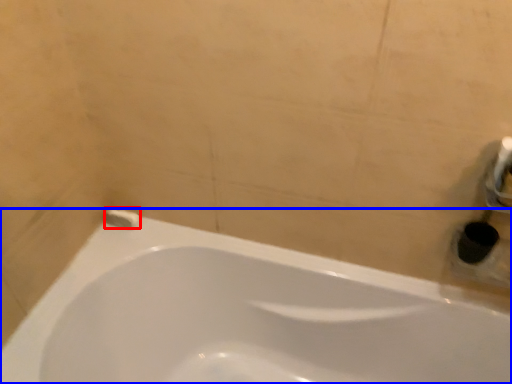
Question: Which point is closer to the camera, toilet paper (highlighted by a red box) or bathtub (highlighted by a blue box)?

Choices:
 (A) toilet paper
 (B) bathtub

Answer: (B)